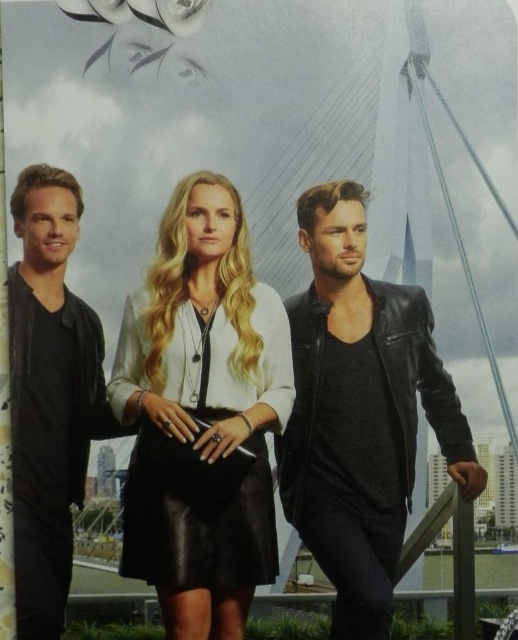
At what (x,y) coordinates should I click in order to perform the action: click on black leather jacket at center. Please return your answer as a coordinate pair (x, y). This screenshot has width=518, height=640. Looking at the image, I should click on (361, 412).

Who is lower down, black leather jacket at center or matte black leather jacket at left?

black leather jacket at center is lower down.

Where is `black leather jacket at center`? This screenshot has width=518, height=640. black leather jacket at center is located at coordinates (361, 412).

Can you confirm if black leather skirt at center is wider than matte black leather jacket at left?

Indeed, black leather skirt at center has a greater width compared to matte black leather jacket at left.

The height and width of the screenshot is (640, 518). What do you see at coordinates (202, 413) in the screenshot?
I see `black leather skirt at center` at bounding box center [202, 413].

Who is more distant from viewer, (247, 611) or (32, 416)?

Positioned behind is point (32, 416).

Where is `black leather skirt at center`? This screenshot has width=518, height=640. black leather skirt at center is located at coordinates (202, 413).

Describe the element at coordinates (202, 413) in the screenshot. This screenshot has height=640, width=518. I see `black leather skirt at center` at that location.

Measure the distance from black leather skirt at center to black leather jacket at center.

A distance of 30.95 feet exists between black leather skirt at center and black leather jacket at center.

This screenshot has height=640, width=518. What do you see at coordinates (202, 413) in the screenshot?
I see `black leather skirt at center` at bounding box center [202, 413].

Where is `black leather skirt at center`? black leather skirt at center is located at coordinates (202, 413).